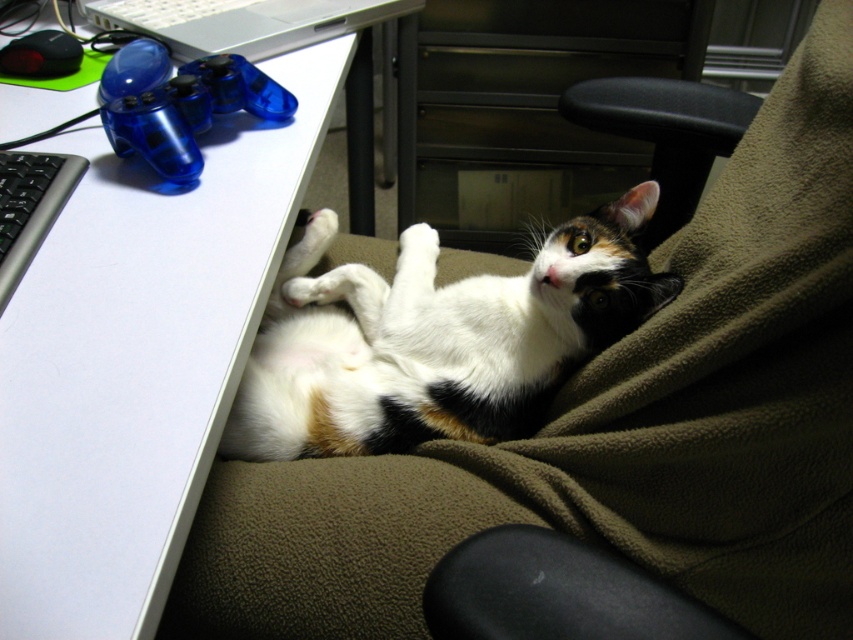
Question: Among these points, which one is farthest from the camera?

Choices:
 (A) (126, 588)
 (B) (431, 380)

Answer: (B)

Question: Which point is farther to the camera?

Choices:
 (A) calico fur cat at lower right
 (B) silver metallic laptop at upper left
 (C) white plastic computer desk at lower left

Answer: (B)

Question: Is white plastic computer desk at lower left thinner than silver metallic laptop at upper left?

Choices:
 (A) yes
 (B) no

Answer: (B)

Question: Is white plastic computer desk at lower left positioned at the back of calico fur cat at lower right?

Choices:
 (A) yes
 (B) no

Answer: (B)

Question: Does white plastic computer desk at lower left have a greater width compared to calico fur cat at lower right?

Choices:
 (A) yes
 (B) no

Answer: (A)

Question: Which point is closer to the camera taking this photo?

Choices:
 (A) (430, 364)
 (B) (212, 426)
 (C) (189, 3)

Answer: (B)